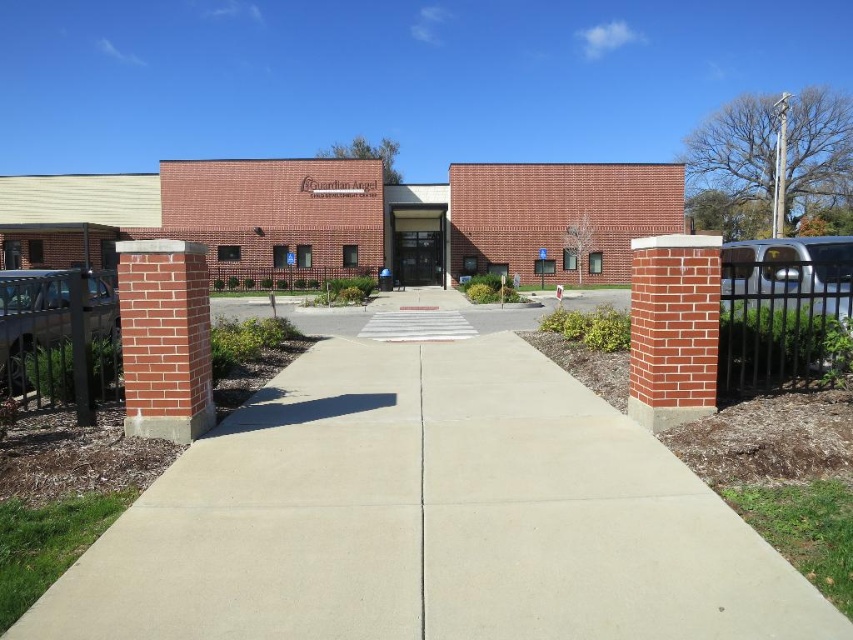
Who is more distant from viewer, (403, 513) or (115, 189)?

The point (115, 189) is more distant.

Between point (276, 413) and point (561, 253), which one is positioned in front?

Positioned in front is point (276, 413).

Is point (323, 454) in front of point (219, 253)?

That is True.

The height and width of the screenshot is (640, 853). What are the coordinates of `concrete at center` in the screenshot? It's located at (428, 518).